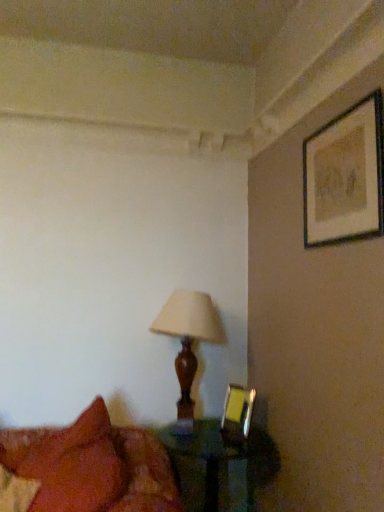
The height and width of the screenshot is (512, 384). Find the location of `free region on the left part of metallic gold picture frame at lower right, placed as the first picture frame when sorted from left to right`. free region on the left part of metallic gold picture frame at lower right, placed as the first picture frame when sorted from left to right is located at coordinates (214, 435).